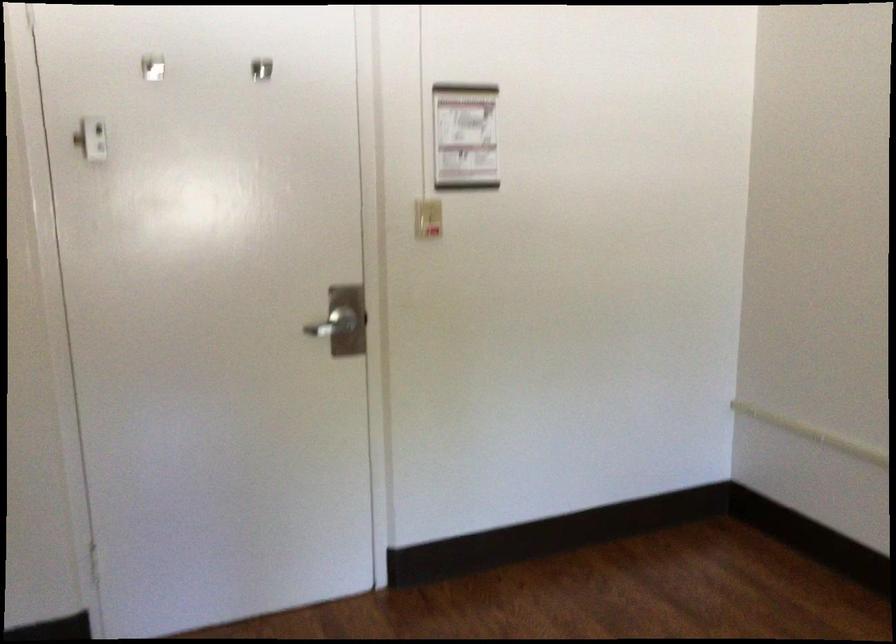
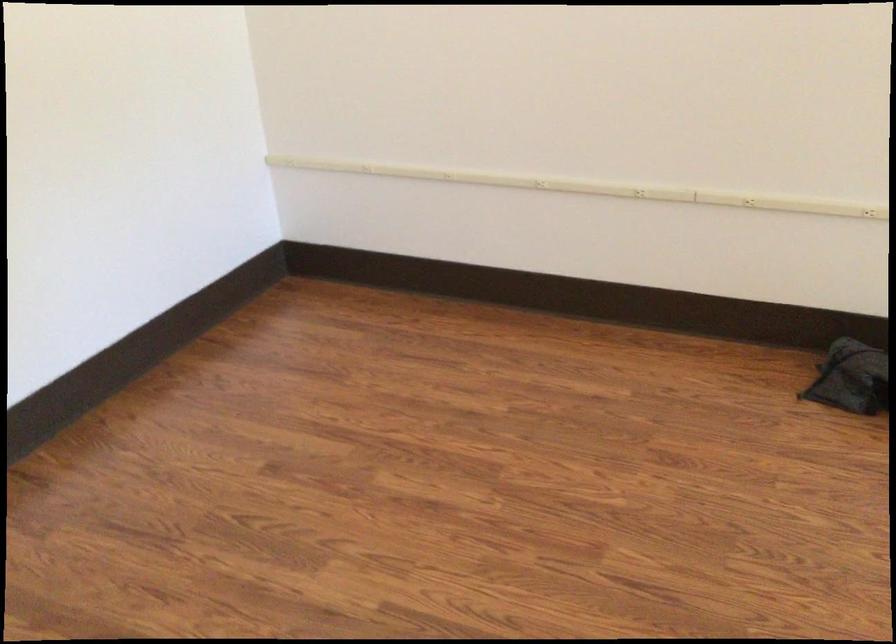
The first image is from the beginning of the video and the second image is from the end. How did the camera likely rotate when shooting the video?

The camera's rotation is toward right-down.